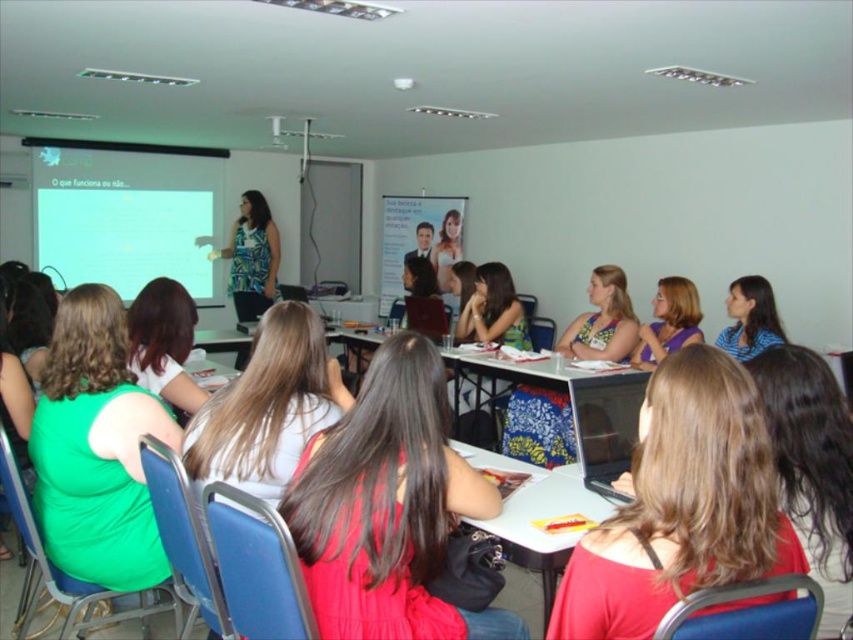
You are sitting in the back row of the classroom and want to see both the blue fabric shirt at center and the matte white blouse at center. Which one is shorter in height?

The blue fabric shirt at center is not as tall as the matte white blouse at center, so the blue fabric shirt at center is shorter in height.

You are organizing a photoshoot and need to place two outfits, the matte red dress at center and the floral fabric skirt at center, on a mannequin stand. The stand can only accommodate one outfit at a time. Considering their widths, which outfit should you choose first to ensure the wider one is displayed properly?

The matte red dress at center has a larger width than the floral fabric skirt at center, so you should display the matte red dress at center first to ensure it fits properly on the mannequin stand.

You are a photographer standing at the back of the classroom. You want to take a photo of the matte red dress at center and the floral fabric skirt at center. Which one should you focus on first to ensure it is in the foreground of the photo?

The matte red dress at center is in front of the floral fabric skirt at center, so you should focus on the matte red dress at center first to ensure it is in the foreground of the photo.